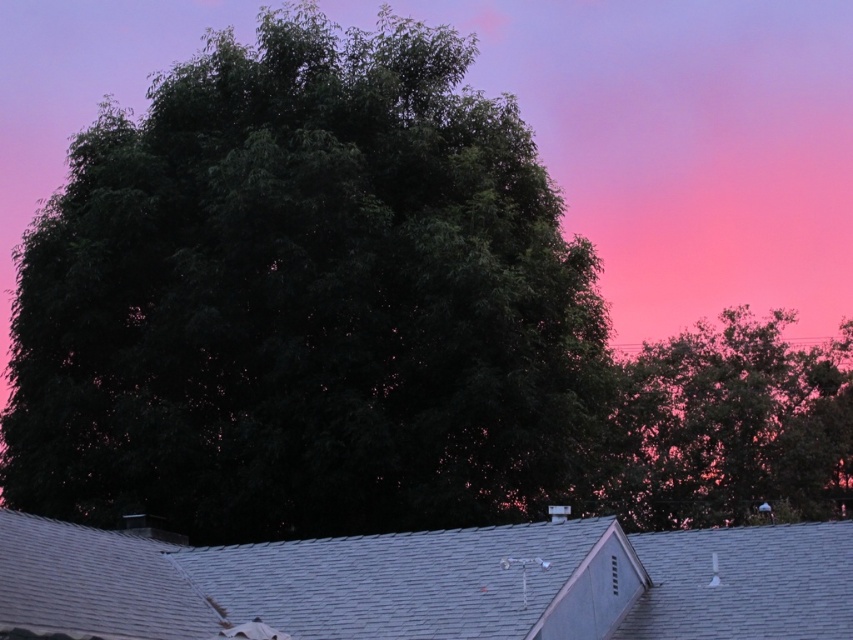
Question: Which point is farther to the camera?

Choices:
 (A) green leafy tree at upper right
 (B) dark green leafy tree at center

Answer: (A)

Question: Which object is positioned closest to the gray shingles at center?

Choices:
 (A) green leafy tree at upper right
 (B) dark green leafy tree at center

Answer: (B)

Question: Is dark green leafy tree at center smaller than gray shingles at center?

Choices:
 (A) yes
 (B) no

Answer: (B)

Question: Which point is farther from the camera taking this photo?

Choices:
 (A) (726, 333)
 (B) (225, 550)
 (C) (381, 234)

Answer: (A)

Question: Is the position of dark green leafy tree at center less distant than that of green leafy tree at upper right?

Choices:
 (A) yes
 (B) no

Answer: (A)

Question: Can you confirm if dark green leafy tree at center is positioned above green leafy tree at upper right?

Choices:
 (A) no
 (B) yes

Answer: (B)